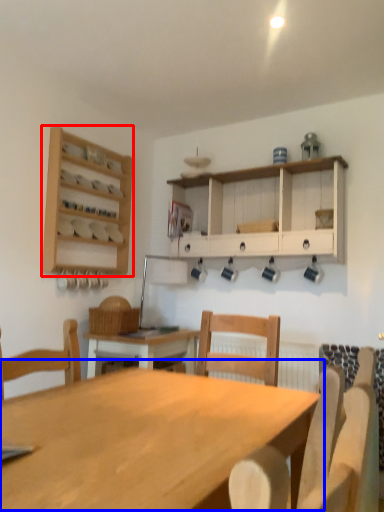
Question: Which object appears farthest to the camera in this image, shelf (highlighted by a red box) or table (highlighted by a blue box)?

Choices:
 (A) shelf
 (B) table

Answer: (A)